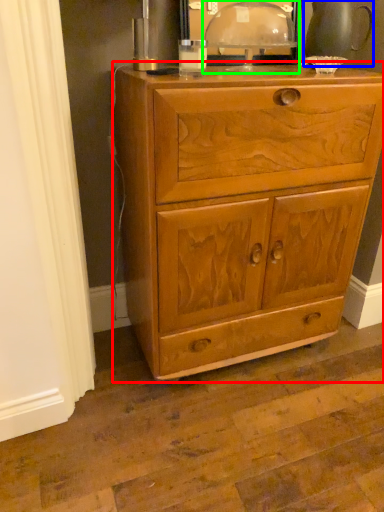
Question: Estimate the real-world distances between objects in this image. Which object is closer to chest of drawers (highlighted by a red box), tea pot (highlighted by a blue box) or table lamp (highlighted by a green box)?

Choices:
 (A) tea pot
 (B) table lamp

Answer: (B)